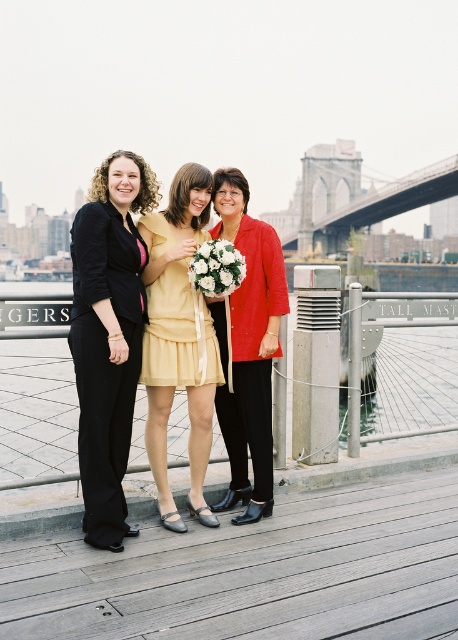
Does matte yellow dress at center have a lesser width compared to white silk bouquet at center?

In fact, matte yellow dress at center might be wider than white silk bouquet at center.

Which is below, matte yellow dress at center or white silk bouquet at center?

matte yellow dress at center is lower down.

Does point (210, 432) lie in front of point (229, 253)?

No.

What are the coordinates of `matte yellow dress at center` in the screenshot? It's located at (179, 339).

Can you confirm if wooden at center is thinner than matte red blazer at center?

In fact, wooden at center might be wider than matte red blazer at center.

Can you confirm if wooden at center is positioned below matte red blazer at center?

Yes, wooden at center is below matte red blazer at center.

Is point (426, 508) behind point (261, 298)?

No, (426, 508) is in front of (261, 298).

Identify the location of wooden at center. (255, 572).

Is matte red blazer at center shorter than yellow satin dress at center?

No, matte red blazer at center is not shorter than yellow satin dress at center.

Can you confirm if matte red blazer at center is positioned above yellow satin dress at center?

No, matte red blazer at center is not above yellow satin dress at center.

Describe the element at coordinates (247, 346) in the screenshot. I see `matte red blazer at center` at that location.

This screenshot has width=458, height=640. In order to click on matte red blazer at center in this screenshot , I will do `click(247, 346)`.